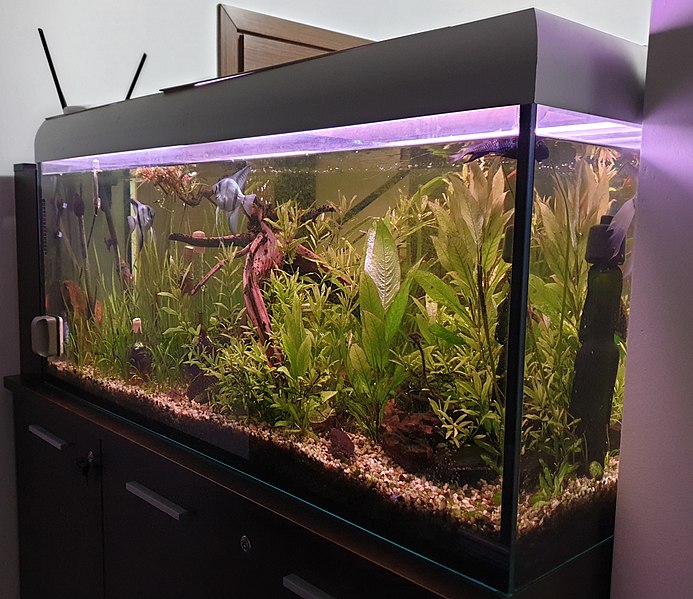
Where is `decoration`? Image resolution: width=693 pixels, height=599 pixels. decoration is located at coordinates (269, 251).